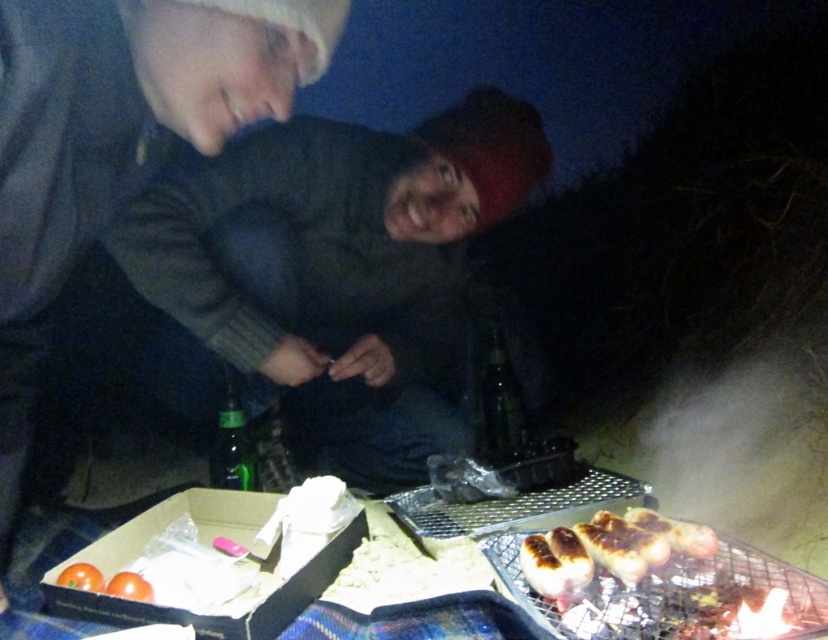
Question: From the image, what is the correct spatial relationship of dark gray sweater at upper left in relation to orange matte tomato at lower left?

Choices:
 (A) right
 (B) left

Answer: (B)

Question: From the image, what is the correct spatial relationship of dark gray sweater at upper left in relation to orange matte tomato at lower left?

Choices:
 (A) below
 (B) above

Answer: (B)

Question: Based on their relative distances, which object is farther from the charred white bread at lower right?

Choices:
 (A) orange matte tomato at lower left
 (B) dark gray sweater at upper left
 (C) smooth orange tomato at lower left

Answer: (C)

Question: Estimate the real-world distances between objects in this image. Which object is farther from the charred white bread at lower right?

Choices:
 (A) orange matte tomato at lower left
 (B) smooth orange tomato at lower left
 (C) dark gray sweater at upper left

Answer: (B)

Question: Which object is positioned closest to the smooth orange tomato at lower left?

Choices:
 (A) charred white bread at lower right
 (B) dark gray sweater at upper left
 (C) orange matte tomato at lower left

Answer: (C)

Question: Can you confirm if charred white bread at lower right is positioned to the left of smooth orange tomato at lower left?

Choices:
 (A) no
 (B) yes

Answer: (A)